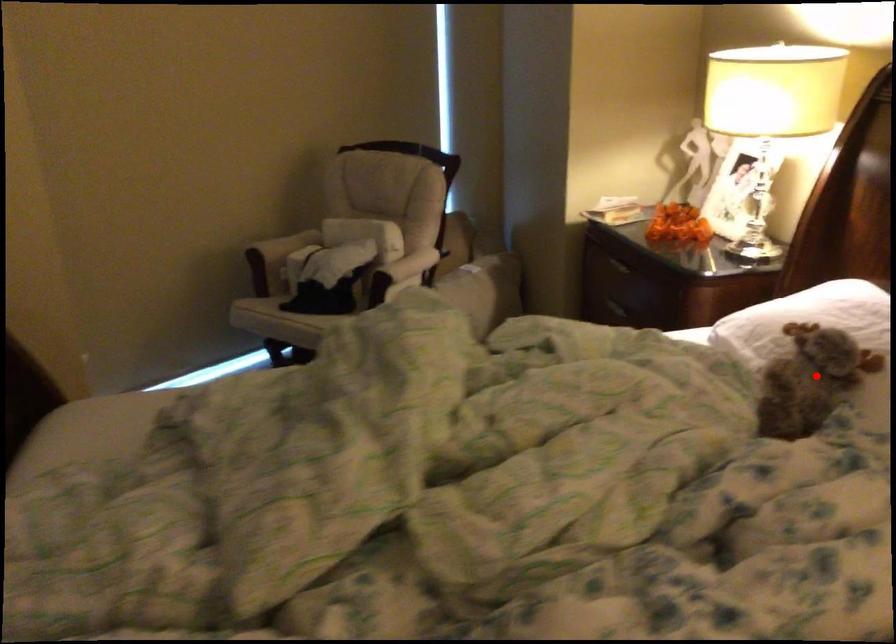
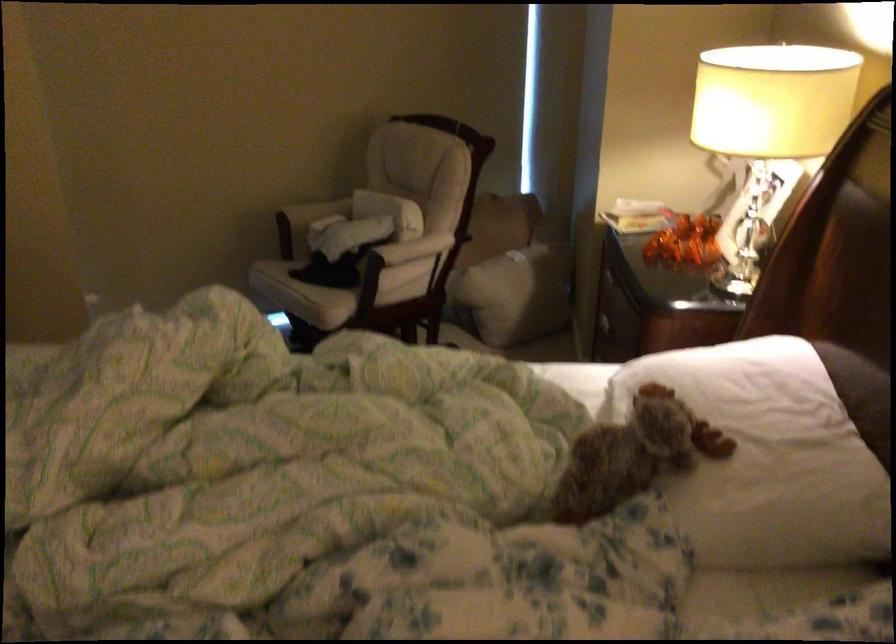
Where in the second image is the point corresponding to the highlighted location from the first image?

(633, 453)